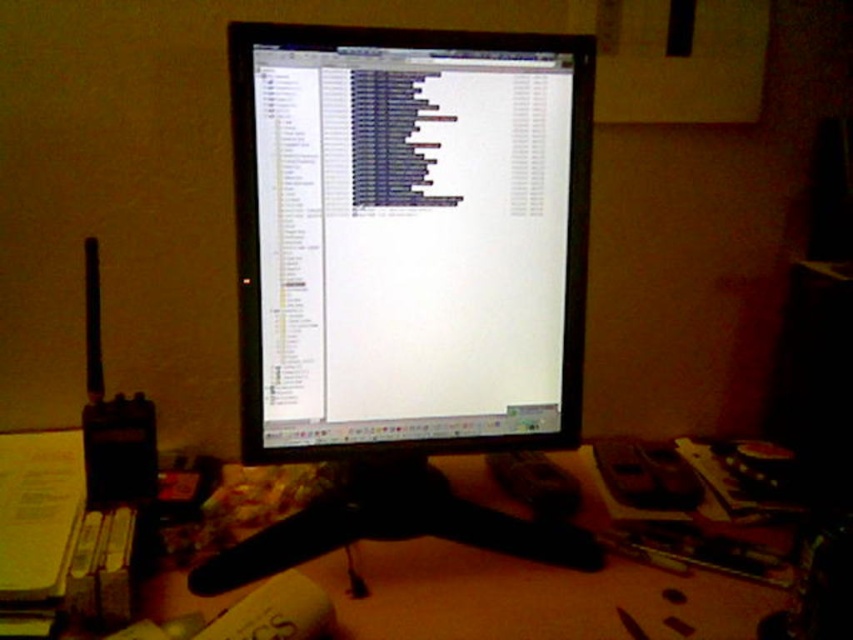
Can you confirm if matte black monitor at center is smaller than wooden at center?

Correct, matte black monitor at center occupies less space than wooden at center.

Between matte black monitor at center and wooden at center, which one has less height?

With less height is wooden at center.

This screenshot has width=853, height=640. Find the location of `matte black monitor at center`. matte black monitor at center is located at coordinates (409, 237).

Where is `matte black monitor at center`? matte black monitor at center is located at coordinates (409, 237).